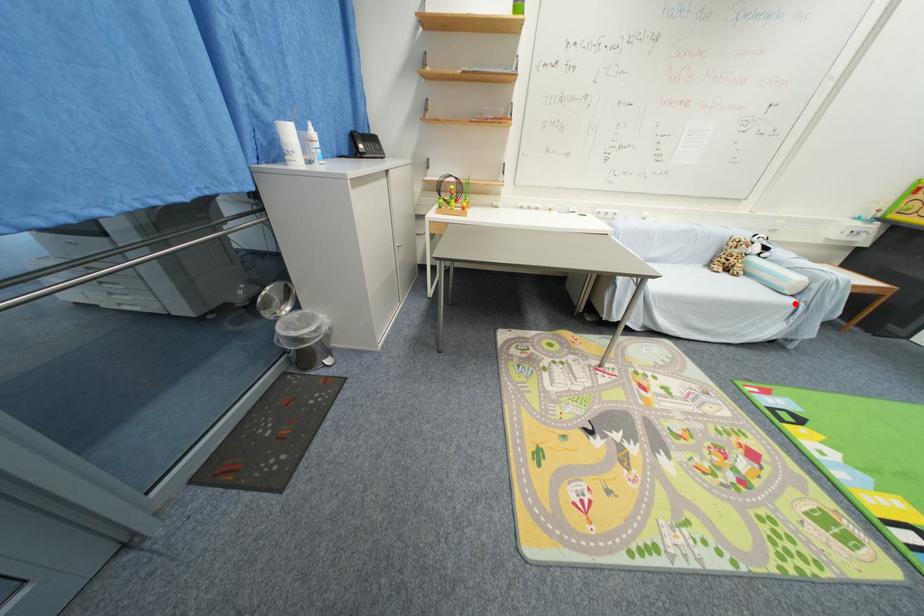
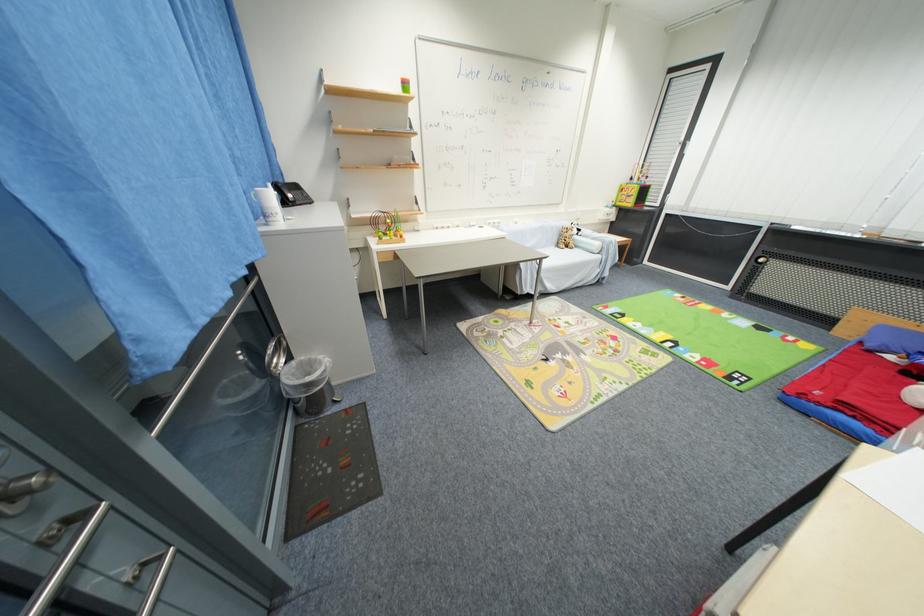
Question: I am providing you with two images of the same scene from different viewpoints. Given a red point in image1, look at the same physical point in image2. Is it:

Choices:
 (A) Closer to the viewpoint
 (B) Farther from the viewpoint

Answer: (A)